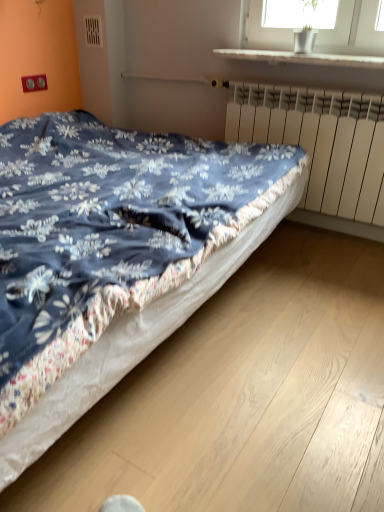
Question: Based on their sizes in the image, would you say white glossy window sill at upper center is bigger or smaller than white matte radiator at right?

Choices:
 (A) big
 (B) small

Answer: (B)

Question: In terms of width, does white glossy window sill at upper center look wider or thinner when compared to white matte radiator at right?

Choices:
 (A) wide
 (B) thin

Answer: (A)

Question: Which object is positioned farthest from the white matte radiator at right?

Choices:
 (A) blue floral fabric bed at center
 (B) white glossy window sill at upper center

Answer: (A)

Question: Which is farther from the white glossy window sill at upper center?

Choices:
 (A) white matte radiator at right
 (B) blue floral fabric bed at center

Answer: (B)